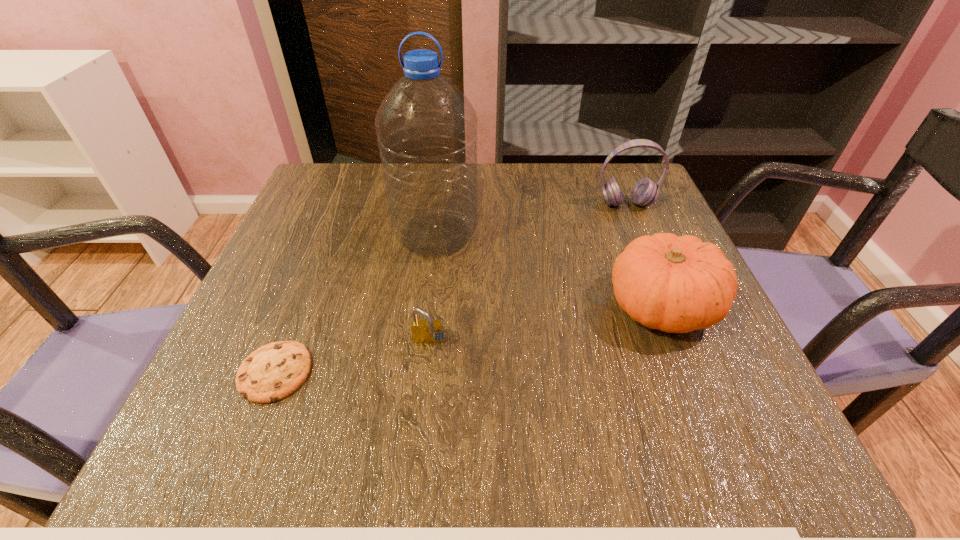
Where is `water jug`? The height and width of the screenshot is (540, 960). water jug is located at coordinates (426, 128).

Identify the location of headset. The height and width of the screenshot is (540, 960). (645, 192).

Identify the location of the third tallest object. This screenshot has width=960, height=540. (675, 284).

I want to click on the second shortest object, so click(x=427, y=331).

Identify the location of the shortest object. This screenshot has width=960, height=540. (271, 373).

The image size is (960, 540). I want to click on the leftmost object, so click(x=271, y=373).

The height and width of the screenshot is (540, 960). I want to click on free space located on the right of the water jug, so click(602, 234).

The height and width of the screenshot is (540, 960). What are the coordinates of `vacant space situated 0.330m on the headband and ear cups of the second tallest object` in the screenshot? It's located at (674, 322).

At what (x,y) coordinates should I click in order to perform the action: click on vacant space situated on the back of the pumpkin. Please return your answer as a coordinate pair (x, y). Looking at the image, I should click on (625, 216).

Locate an element on the screen. This screenshot has height=540, width=960. vacant space situated 0.140m on the side with the combination dials of the fourth tallest object is located at coordinates (420, 431).